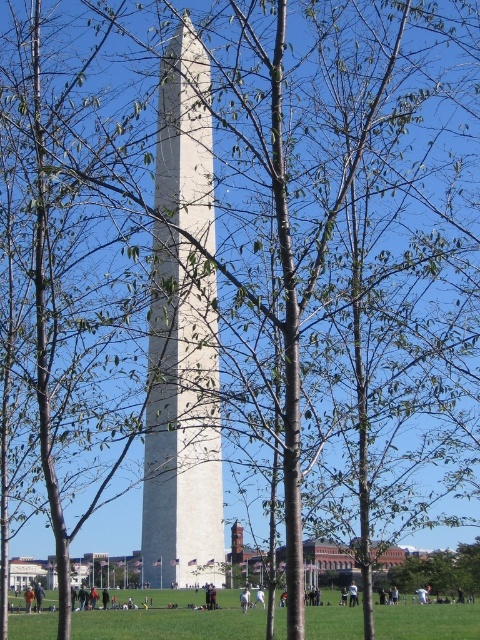
Which of these two, light blue shirt at center or orange fabric person at center, stands taller?

light blue shirt at center

Describe the element at coordinates (352, 593) in the screenshot. This screenshot has height=640, width=480. I see `light blue shirt at center` at that location.

The width and height of the screenshot is (480, 640). What are the coordinates of `light blue shirt at center` in the screenshot? It's located at (352, 593).

Can you confirm if green leafy tree at lower right is positioned below white cotton pants at center?

Actually, green leafy tree at lower right is above white cotton pants at center.

Which is above, green leafy tree at lower right or white cotton pants at center?

green leafy tree at lower right

Where is `green leafy tree at lower right`? The image size is (480, 640). green leafy tree at lower right is located at coordinates (441, 570).

Does white marble obelisk at center lie behind orange fabric person at lower center?

No, it is not.

Between white marble obelisk at center and orange fabric person at lower center, which one appears on the right side from the viewer's perspective?

white marble obelisk at center is more to the right.

Which is in front, point (220, 513) or point (37, 596)?

Point (220, 513)

At what (x,y) coordinates should I click in order to perform the action: click on white marble obelisk at center. Please return your answer as a coordinate pair (x, y). Image resolution: width=480 pixels, height=640 pixels. Looking at the image, I should click on (182, 337).